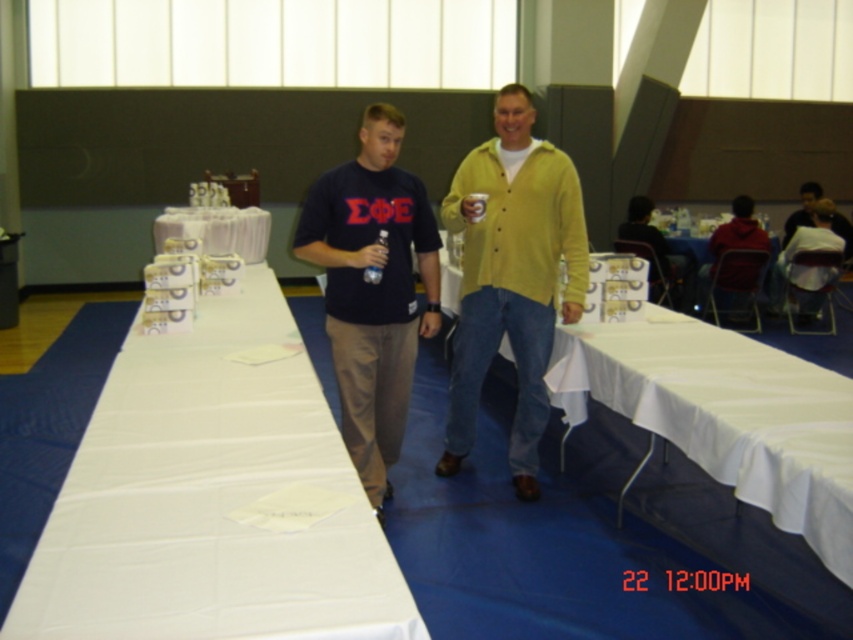
Question: Which object is positioned farthest from the white cardboard boxes at center?

Choices:
 (A) white fabric table at center
 (B) matte black t-shirt at center
 (C) dark blue t-shirt at center

Answer: (B)

Question: Which of the following is the farthest from the observer?

Choices:
 (A) (431, 298)
 (B) (224, 234)
 (C) (16, 602)
 (D) (525, 422)

Answer: (B)

Question: Does dark blue t-shirt at center have a smaller size compared to yellow matte cardigan at center?

Choices:
 (A) yes
 (B) no

Answer: (B)

Question: Does matte black t-shirt at center appear on the right side of white cardboard boxes at center?

Choices:
 (A) yes
 (B) no

Answer: (A)

Question: Does white fabric table at center appear on the right side of matte black t-shirt at center?

Choices:
 (A) no
 (B) yes

Answer: (A)

Question: Which point is closer to the camera?

Choices:
 (A) (514, 348)
 (B) (496, 97)
 (C) (177, 214)

Answer: (A)